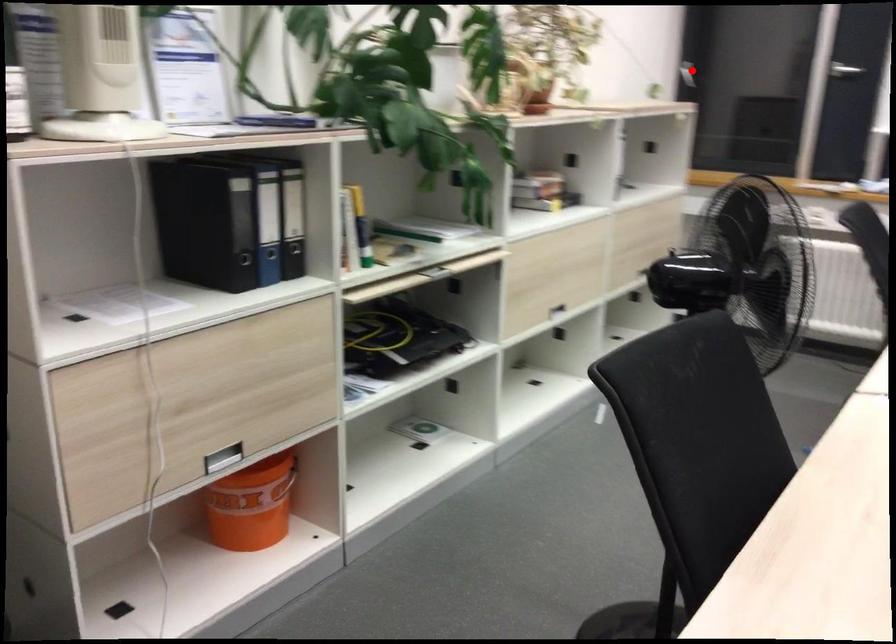
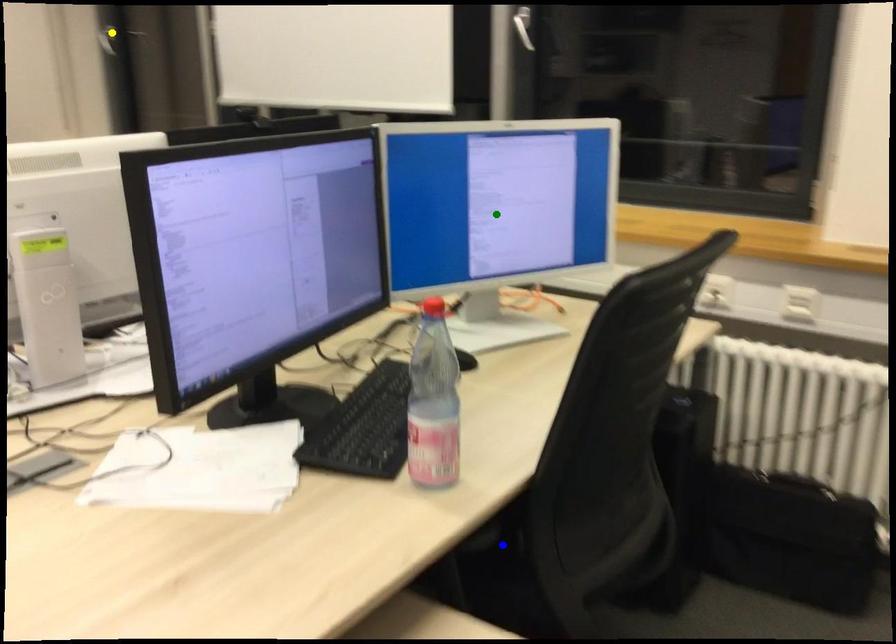
Question: I am providing you with two images of the same scene from different viewpoints. A red point is marked on the first image. You are given multiple points on the second image. Which point in image 2 represents the same 3d spot as the red point in image 1?

Choices:
 (A) blue point
 (B) green point
 (C) yellow point

Answer: (C)